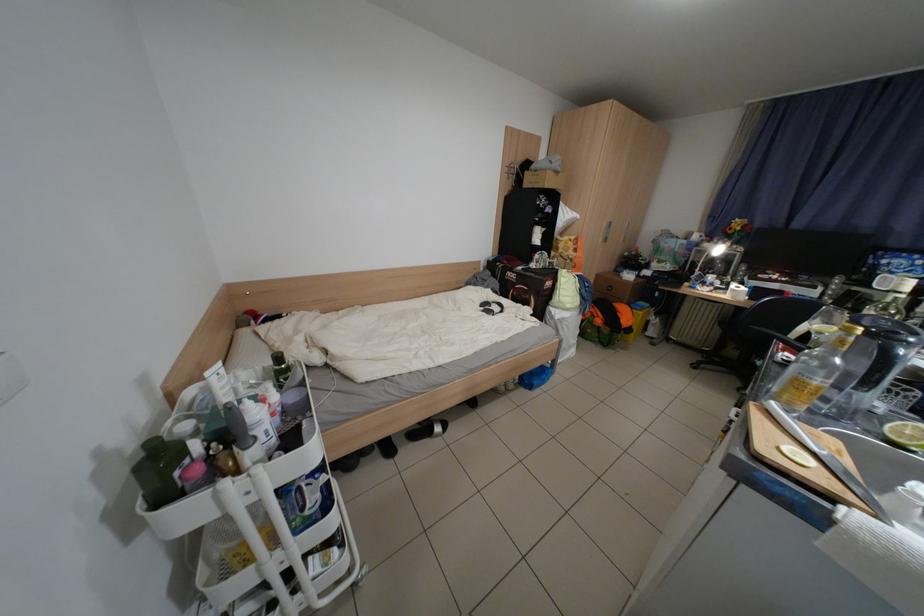
Locate an element on the screen. This screenshot has height=616, width=924. wardrobe door handle is located at coordinates (608, 231).